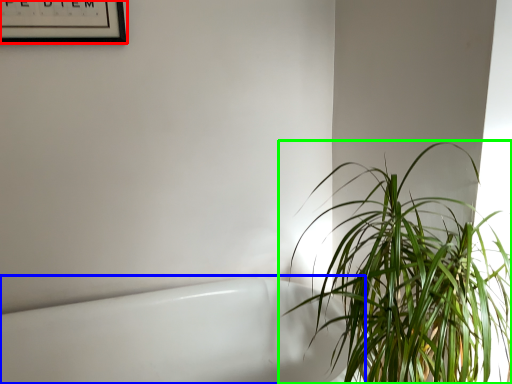
Question: Which object is the farthest from picture frame (highlighted by a red box)? Choose among these: bath (highlighted by a blue box) or houseplant (highlighted by a green box).

Choices:
 (A) bath
 (B) houseplant

Answer: (B)